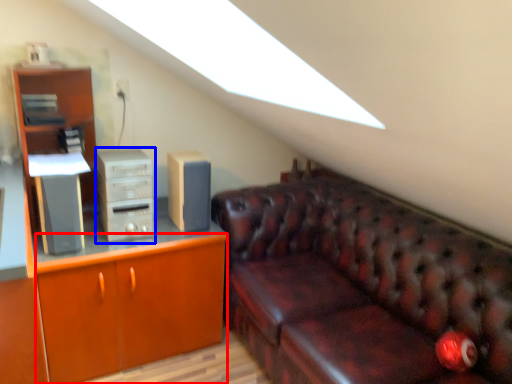
Question: Which object is closer to the camera taking this photo, cabinetry (highlighted by a red box) or computer tower (highlighted by a blue box)?

Choices:
 (A) cabinetry
 (B) computer tower

Answer: (A)